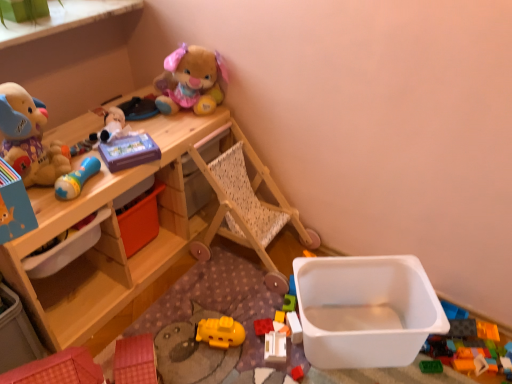
This screenshot has width=512, height=384. I want to click on vacant region to the left of translucent plastic blocks at center, which ranks as the seventh toy in top-to-bottom order, so click(x=247, y=333).